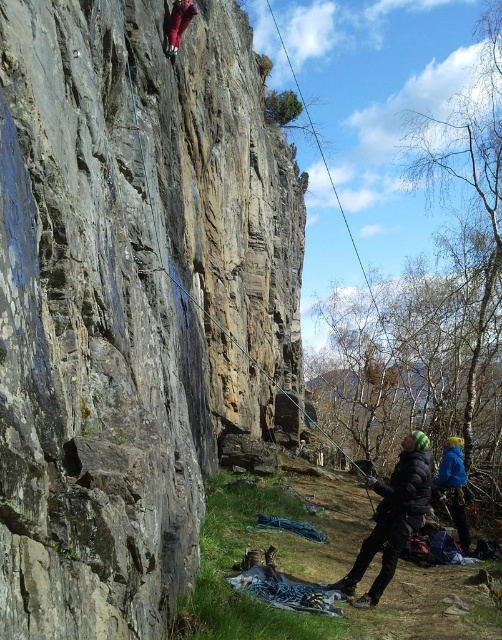
Question: Does black puffy jacket at lower center appear under blue fleece jacket at lower right?

Choices:
 (A) no
 (B) yes

Answer: (A)

Question: Does blue fleece jacket at lower right appear over shiny red leggings at upper left?

Choices:
 (A) no
 (B) yes

Answer: (A)

Question: Which object is farther from the camera taking this photo?

Choices:
 (A) rough gray rock at center
 (B) black puffy jacket at lower center
 (C) blue fleece jacket at lower right
 (D) shiny red leggings at upper left

Answer: (C)

Question: Is rough gray rock at center positioned in front of black puffy jacket at lower center?

Choices:
 (A) yes
 (B) no

Answer: (A)

Question: Which is farther from the black puffy jacket at lower center?

Choices:
 (A) shiny red leggings at upper left
 (B) blue fleece jacket at lower right

Answer: (A)

Question: Among these objects, which one is nearest to the camera?

Choices:
 (A) black puffy jacket at lower center
 (B) rough gray rock at center

Answer: (B)